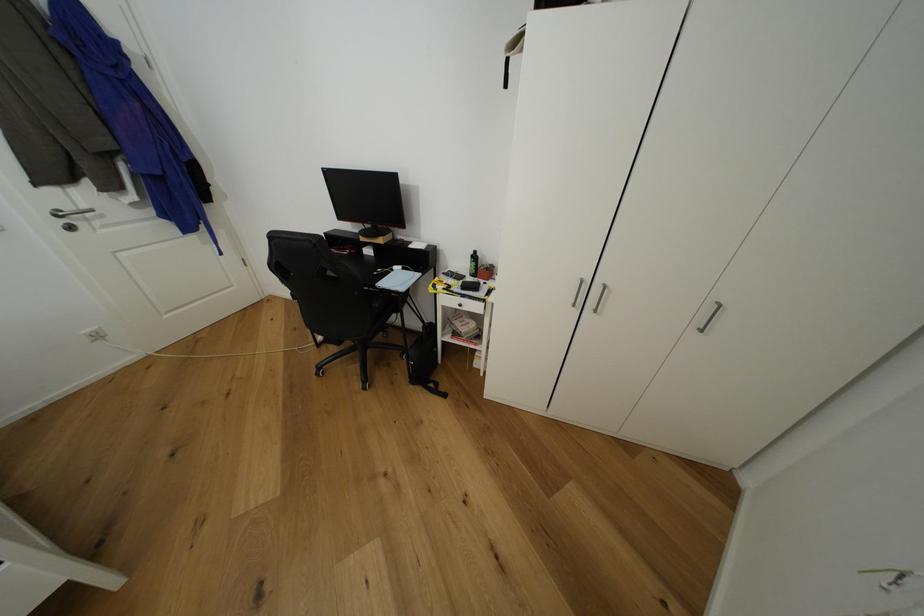
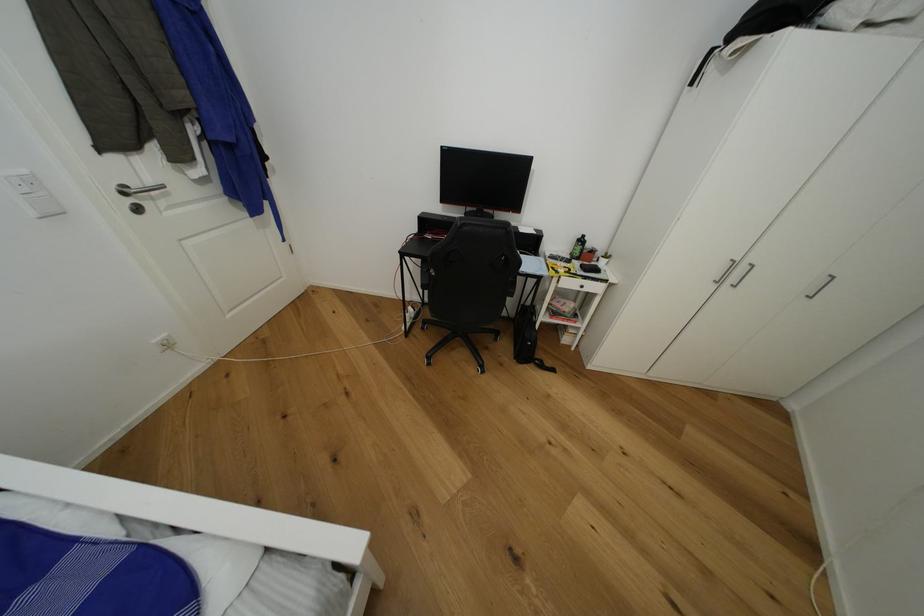
Question: In a continuous first-person perspective shot, in which direction is the camera moving?

Choices:
 (A) Left
 (B) Right
 (C) Forward
 (D) Backward

Answer: (A)